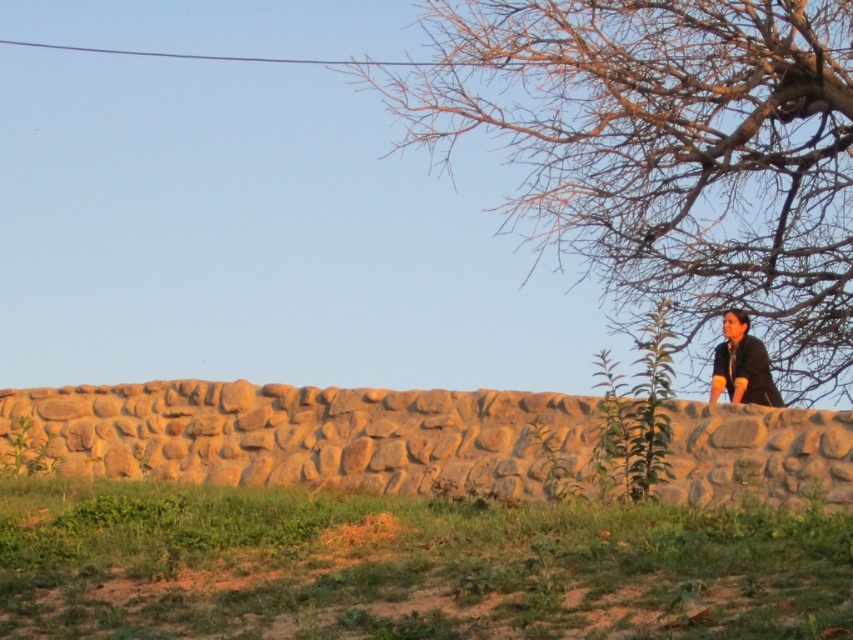
Between rustic stone wall at center and black matte shirt at upper right, which one has more height?

black matte shirt at upper right

Which is more to the right, rustic stone wall at center or black matte shirt at upper right?

From the viewer's perspective, black matte shirt at upper right appears more on the right side.

Describe the element at coordinates (308, 435) in the screenshot. I see `rustic stone wall at center` at that location.

Where is `rustic stone wall at center`? The image size is (853, 640). rustic stone wall at center is located at coordinates (308, 435).

Does brown textured tree at upper right appear on the right side of black matte shirt at upper right?

Correct, you'll find brown textured tree at upper right to the right of black matte shirt at upper right.

Who is taller, brown textured tree at upper right or black matte shirt at upper right?

With more height is black matte shirt at upper right.

Image resolution: width=853 pixels, height=640 pixels. Describe the element at coordinates (666, 154) in the screenshot. I see `brown textured tree at upper right` at that location.

At what (x,y) coordinates should I click in order to perform the action: click on brown textured tree at upper right. Please return your answer as a coordinate pair (x, y). The height and width of the screenshot is (640, 853). Looking at the image, I should click on (666, 154).

In the scene shown: Which is more to the left, brown textured tree at upper right or rustic stone wall at center?

From the viewer's perspective, rustic stone wall at center appears more on the left side.

Describe the element at coordinates (666, 154) in the screenshot. The height and width of the screenshot is (640, 853). I see `brown textured tree at upper right` at that location.

Locate an element on the screen. This screenshot has width=853, height=640. brown textured tree at upper right is located at coordinates (666, 154).